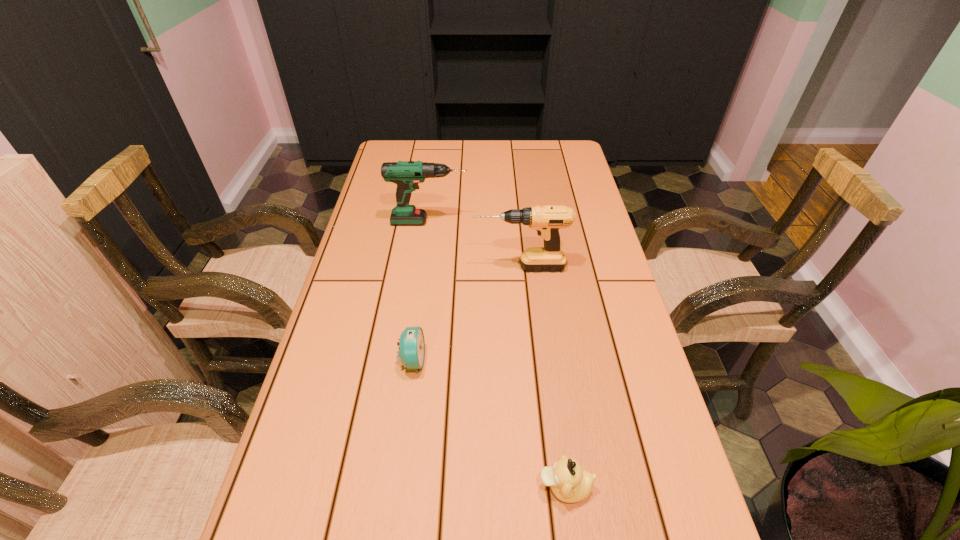
Find the location of a particular element. The image size is (960, 540). vacant space located on the front-facing side of the alarm clock is located at coordinates pyautogui.click(x=600, y=361).

You are a GUI agent. You are given a task and a screenshot of the screen. Output one action in this format:
    pyautogui.click(x=<x>, y=<y>)
    Task: Click on the free spot located 0.080m on the face of the nearest object
    
    Given the screenshot: What is the action you would take?
    pyautogui.click(x=494, y=487)

Where is `vacant space located on the face of the nearest object`? vacant space located on the face of the nearest object is located at coordinates (462, 487).

At what (x,y) coordinates should I click in order to perform the action: click on free space located 0.260m on the face of the nearest object. Please return your answer as a coordinate pair (x, y). Looking at the image, I should click on [x=396, y=487].

The height and width of the screenshot is (540, 960). Identify the location of object at the left edge. (406, 174).

Find the location of a particular element. object at the right edge is located at coordinates (547, 220).

Image resolution: width=960 pixels, height=540 pixels. In order to click on vacant area at the far edge of the desktop in this screenshot , I will do `click(456, 146)`.

Where is `free location at the left edge`? free location at the left edge is located at coordinates (380, 269).

At what (x,y) coordinates should I click in order to perform the action: click on vacant space at the right edge of the desktop. Please return your answer as a coordinate pair (x, y). Looking at the image, I should click on (600, 462).

In the image, there is a desktop. At what (x,y) coordinates should I click in order to perform the action: click on vacant area at the far left corner. Please return your answer as a coordinate pair (x, y). The width and height of the screenshot is (960, 540). Looking at the image, I should click on (423, 150).